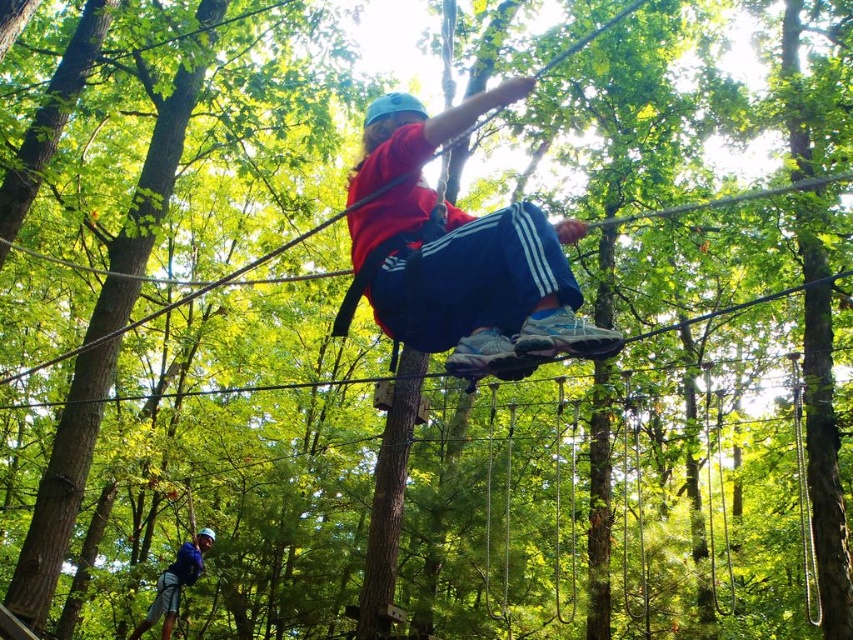
You are a safety inspector checking the ropes course setup. You notice the matte red shirt at center and the blue fabric helmet at lower left. Which object has a greater width?

The matte red shirt at center has a greater width than the blue fabric helmet at lower left.

You are an adventure guide assessing the safety of the ropes course. You notice the matte red shirt at center and the blue fabric helmet at lower left. Which object would appear closer to the camera based on their sizes?

The matte red shirt at center appears larger than the blue fabric helmet at lower left, so it would be closer to the camera.

You are a safety inspector assessing the ropes course setup. You notice the matte red shirt at center, which belongs to a participant. To ensure safety, you need to confirm if the distance between the participant and the camera is within the recommended 2.5 meters for clear monitoring. Is the distance compliant?

The distance between the matte red shirt at center and the camera is 2.07 meters, which is within the recommended 2.5 meters for clear monitoring, so it is compliant.